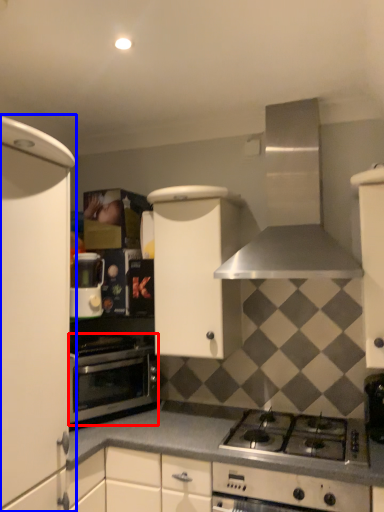
Question: Which point is further to the camera, oven (highlighted by a red box) or cabinetry (highlighted by a blue box)?

Choices:
 (A) oven
 (B) cabinetry

Answer: (A)